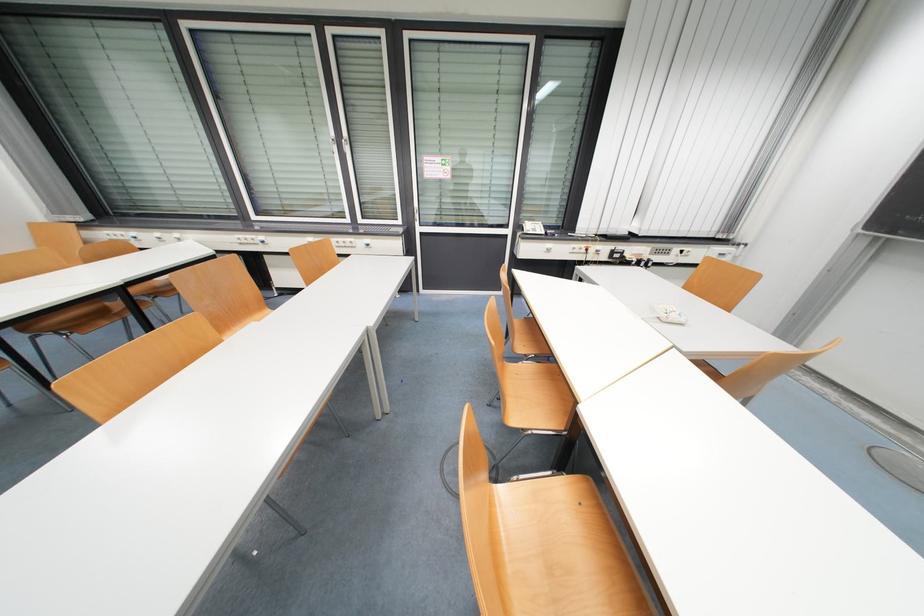
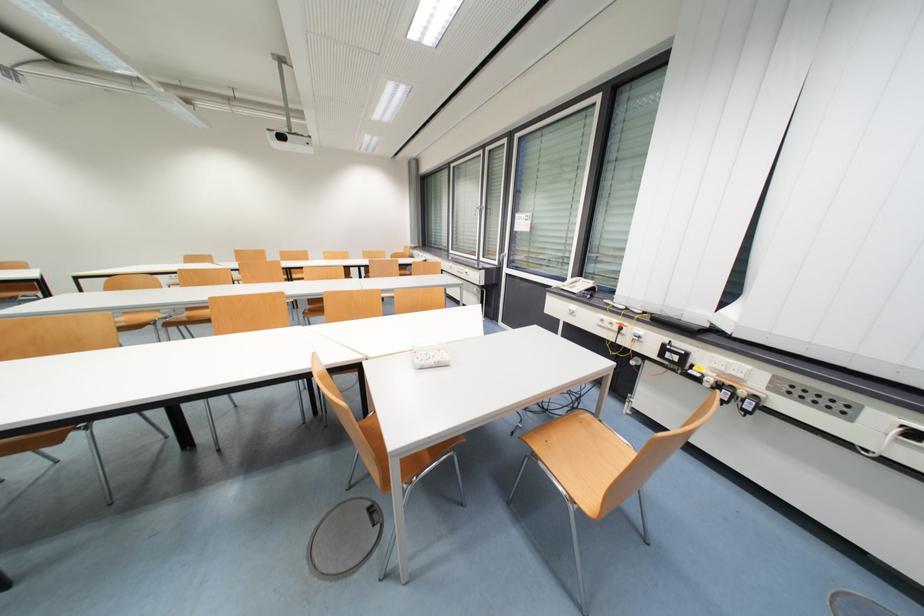
In the second image, find the point that corresponds to [617,254] in the first image.

(671, 350)